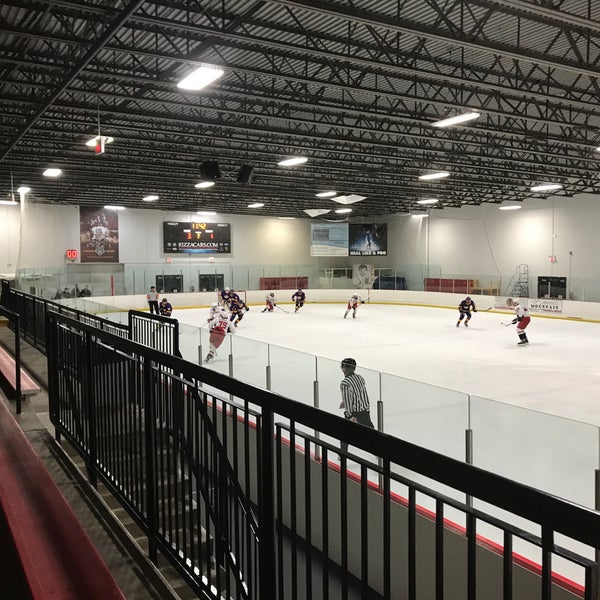
At what (x,y) coordinates should I click in order to perform the action: click on bench. Please return your answer as a coordinate pair (x, y). Looking at the image, I should click on (25, 385), (69, 552).